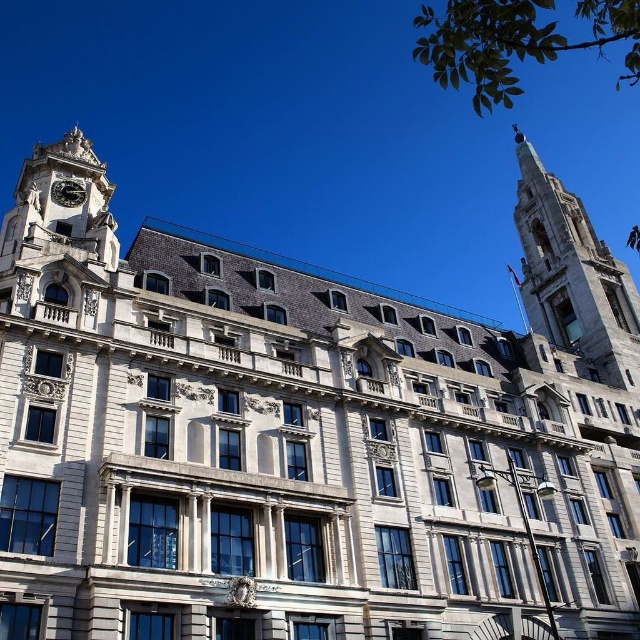
Question: Does polished stone spire at upper right appear on the left side of polished brass clock at upper left?

Choices:
 (A) no
 (B) yes

Answer: (A)

Question: Among these objects, which one is farthest from the camera?

Choices:
 (A) polished brass clock at upper left
 (B) polished stone spire at upper right

Answer: (B)

Question: Is polished stone spire at upper right to the right of polished brass clock at upper left from the viewer's perspective?

Choices:
 (A) yes
 (B) no

Answer: (A)

Question: Is polished stone spire at upper right further to the viewer compared to polished brass clock at upper left?

Choices:
 (A) yes
 (B) no

Answer: (A)

Question: Which object is closer to the camera taking this photo?

Choices:
 (A) polished brass clock at upper left
 (B) polished stone spire at upper right

Answer: (A)